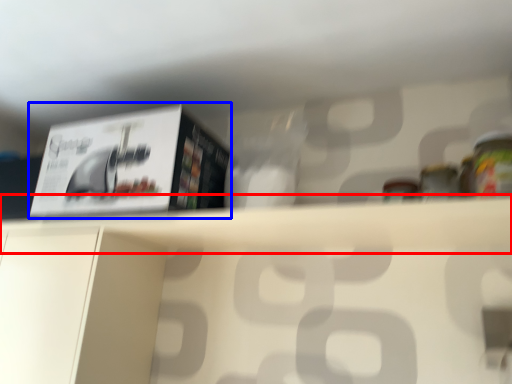
Question: Which point is further to the camera, shelf (highlighted by a red box) or paperback book (highlighted by a blue box)?

Choices:
 (A) shelf
 (B) paperback book

Answer: (B)